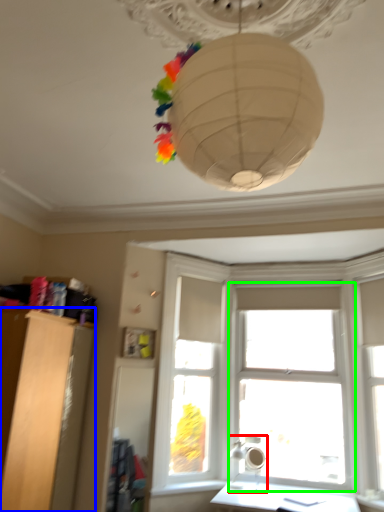
Question: Considering the real-world distances, which object is closest to lamp (highlighted by a red box)? furniture (highlighted by a blue box) or window (highlighted by a green box).

Choices:
 (A) furniture
 (B) window

Answer: (B)